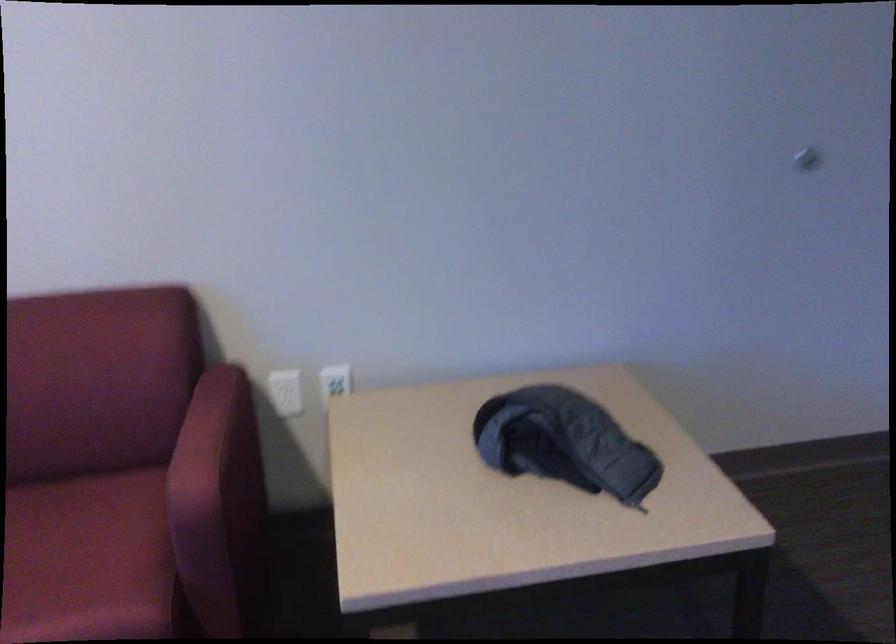
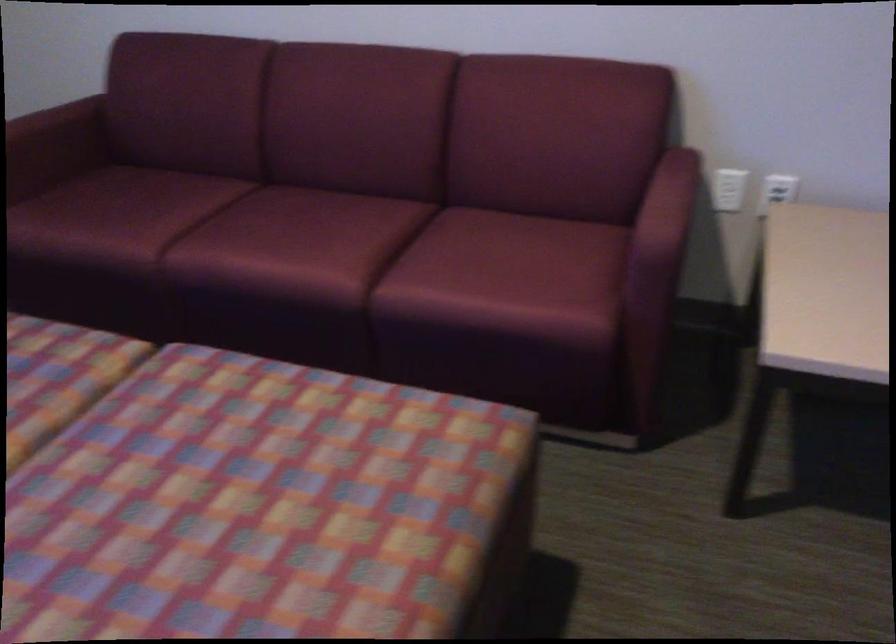
Find the pixel in the second image that matches point 219,390 in the first image.

(678, 166)